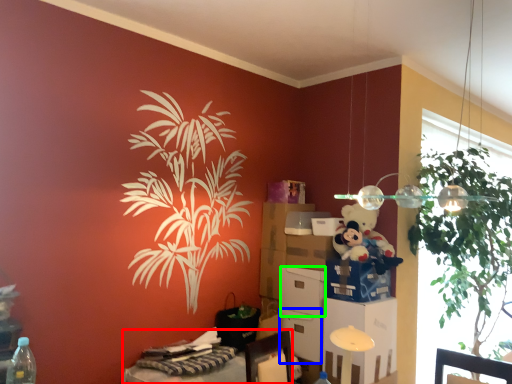
Question: Based on their relative distances, which object is farther from desk (highlighted by a red box)? Choose from box (highlighted by a blue box) and box (highlighted by a green box).

Choices:
 (A) box
 (B) box

Answer: (B)